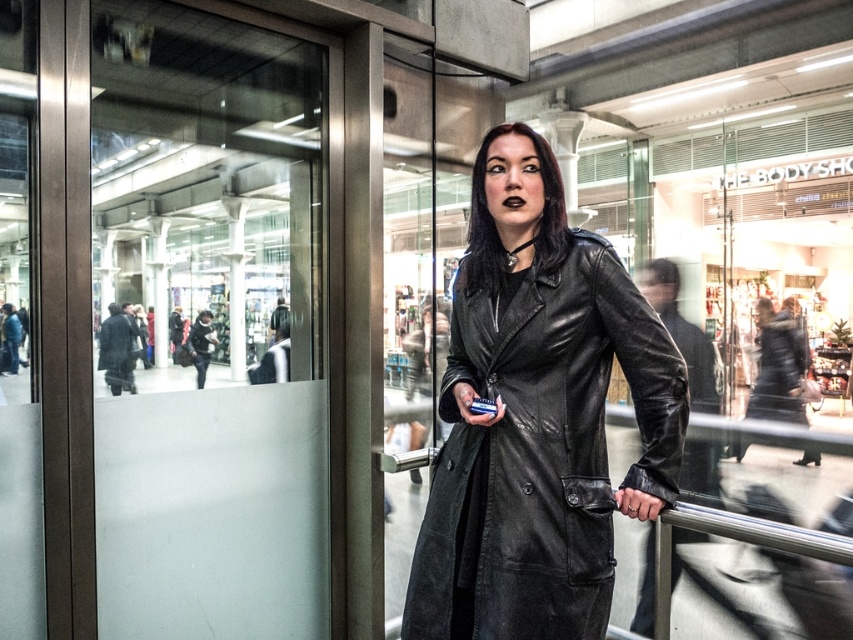
You are standing at the point marked by the coordinate point at (234,221). The glass door is 11.80 meters away from you. Can you walk straight to the glass door without any obstacles?

The distance between you and the glass door is 11.80 meters. Since there are no obstacles mentioned in the scene description, you can walk straight to the glass door.

You are a fashion designer observing a model wearing both a matte black coat at center and a leather coat at center. Which coat is positioned to the left?

The matte black coat at center is positioned on the left side of the leather coat at center.

You are standing in the shopping mall and want to look at the transparent frosted glass at left. Where should you look to see it?

You should look at point (210, 324) to see the transparent frosted glass at left.